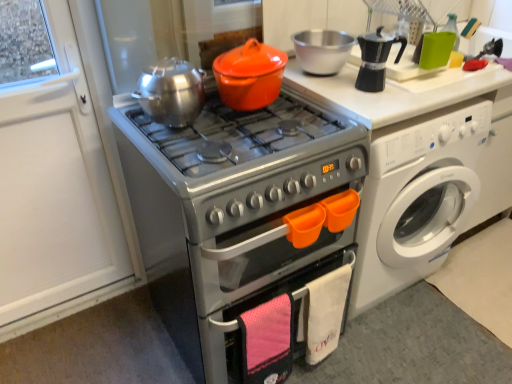
Where is `vacant area that lies to the right of brushed metal tea pot at upper center`? The height and width of the screenshot is (384, 512). vacant area that lies to the right of brushed metal tea pot at upper center is located at coordinates (225, 125).